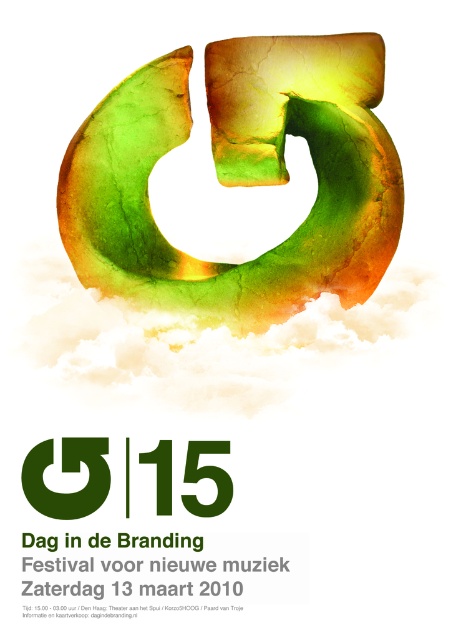
Question: Can you confirm if green cracked stone at center is bigger than green matte circle at center?

Choices:
 (A) no
 (B) yes

Answer: (B)

Question: Does green cracked stone at center appear on the right side of green matte number at center?

Choices:
 (A) yes
 (B) no

Answer: (A)

Question: Does green cracked stone at center lie behind green matte circle at center?

Choices:
 (A) no
 (B) yes

Answer: (A)

Question: Among these points, which one is farthest from the camera?

Choices:
 (A) tap(224, 502)
 (B) tap(71, 508)

Answer: (A)

Question: Which of the following is the farthest from the observer?

Choices:
 (A) (48, 509)
 (B) (217, 508)

Answer: (B)

Question: Which point is farther to the camera?

Choices:
 (A) green matte circle at center
 (B) green matte number at center
 (C) green cracked stone at center

Answer: (B)